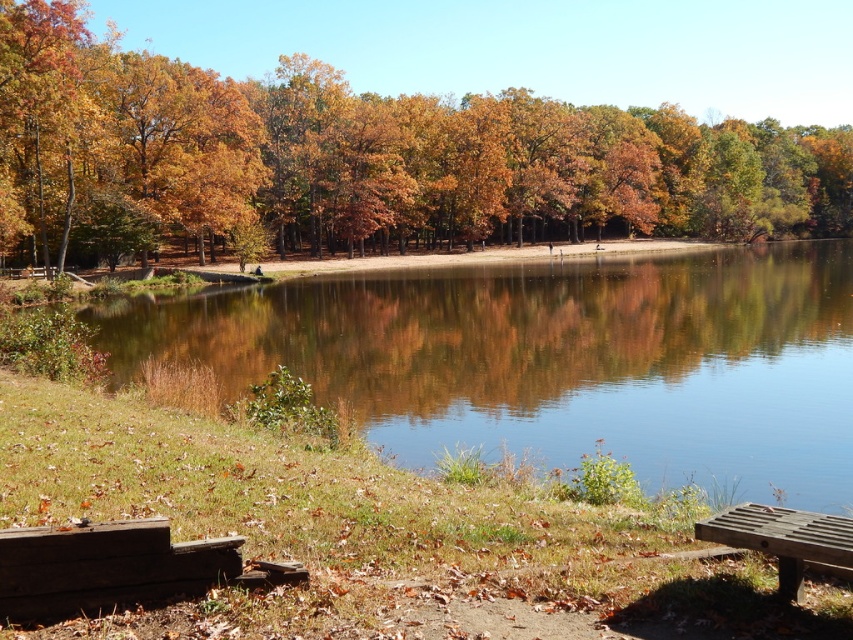
Can you confirm if dark brown wooden bench at lower left is thinner than wooden bench at lower right?

Incorrect, dark brown wooden bench at lower left's width is not less than wooden bench at lower right's.

Is dark brown wooden bench at lower left below wooden bench at lower right?

Incorrect, dark brown wooden bench at lower left is not positioned below wooden bench at lower right.

Is point (67, 570) farther from viewer compared to point (846, 573)?

No, (67, 570) is in front of (846, 573).

Where is `dark brown wooden bench at lower left`? dark brown wooden bench at lower left is located at coordinates (105, 566).

Does clear water at center have a larger size compared to dark brown wooden bench at lower left?

Correct, clear water at center is larger in size than dark brown wooden bench at lower left.

Can you confirm if clear water at center is positioned to the left of dark brown wooden bench at lower left?

No, clear water at center is not to the left of dark brown wooden bench at lower left.

The width and height of the screenshot is (853, 640). What are the coordinates of `clear water at center` in the screenshot? It's located at (554, 358).

The width and height of the screenshot is (853, 640). I want to click on clear water at center, so click(554, 358).

Who is more forward, [543,456] or [695,538]?

Point [695,538] is in front.

Between point (784, 410) and point (785, 595), which one is positioned behind?

The point (784, 410) is behind.

Where is `clear water at center`? Image resolution: width=853 pixels, height=640 pixels. clear water at center is located at coordinates (554, 358).